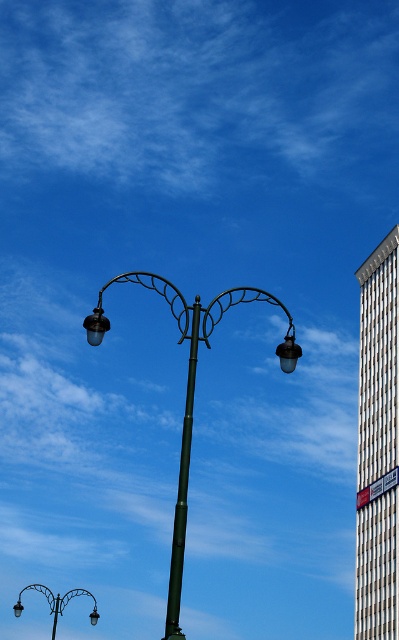
You are a city planner reviewing a street layout. You see the metallic green street light at center and the green metallic pole at center. Which object is located to the right of the other?

The metallic green street light at center is positioned on the right side of green metallic pole at center, meaning it is to the right of the green metallic pole at center.

You are a window cleaner standing on a platform that can only move vertically. You need to clean both the metallic green street light at center and the matte black lamp at upper left. Which one should you clean first based on their positions?

The metallic green street light at center is below the matte black lamp at upper left, so you should clean the matte black lamp at upper left first since it is higher up and you can move downward afterward.